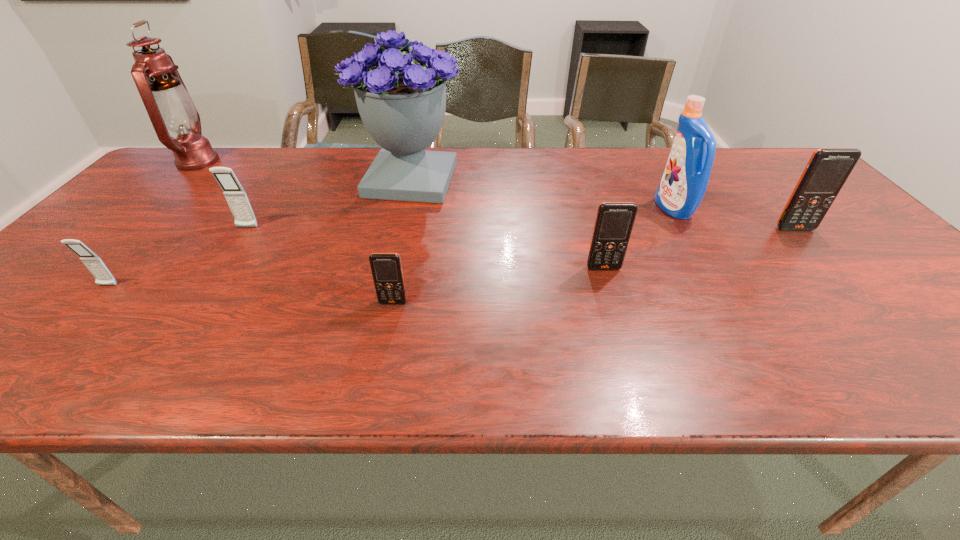
The height and width of the screenshot is (540, 960). What are the coordinates of `oil lamp` in the screenshot? It's located at (170, 107).

This screenshot has height=540, width=960. Identify the location of purple bouquet. (402, 105).

In order to click on the second object from right to left in this screenshot , I will do pyautogui.click(x=685, y=179).

Identify the location of the third tallest object. The width and height of the screenshot is (960, 540). (685, 179).

Image resolution: width=960 pixels, height=540 pixels. What are the coordinates of `the tallest cellular telephone` in the screenshot? It's located at (826, 172).

The image size is (960, 540). In order to click on the rightmost object in this screenshot , I will do `click(826, 172)`.

Identify the location of the right gray cellular telephone. (235, 195).

In order to click on the farther gray cellular telephone in this screenshot , I will do `click(235, 195)`.

Where is `the third nearest object`? The height and width of the screenshot is (540, 960). the third nearest object is located at coordinates (614, 221).

Identify the location of the second smallest orange cellular telephone. (614, 221).